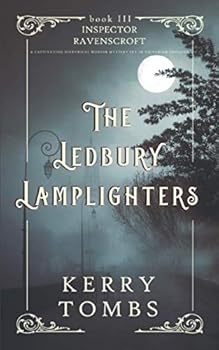
The width and height of the screenshot is (219, 350). Identify the location of lights turned off. (50, 170), (94, 215).